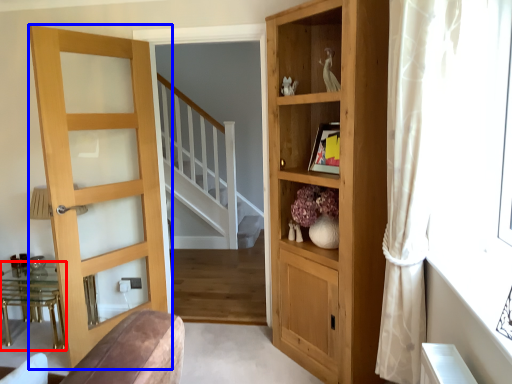
Question: Which point is closer to the camera, table (highlighted by a red box) or door (highlighted by a blue box)?

Choices:
 (A) table
 (B) door

Answer: (B)